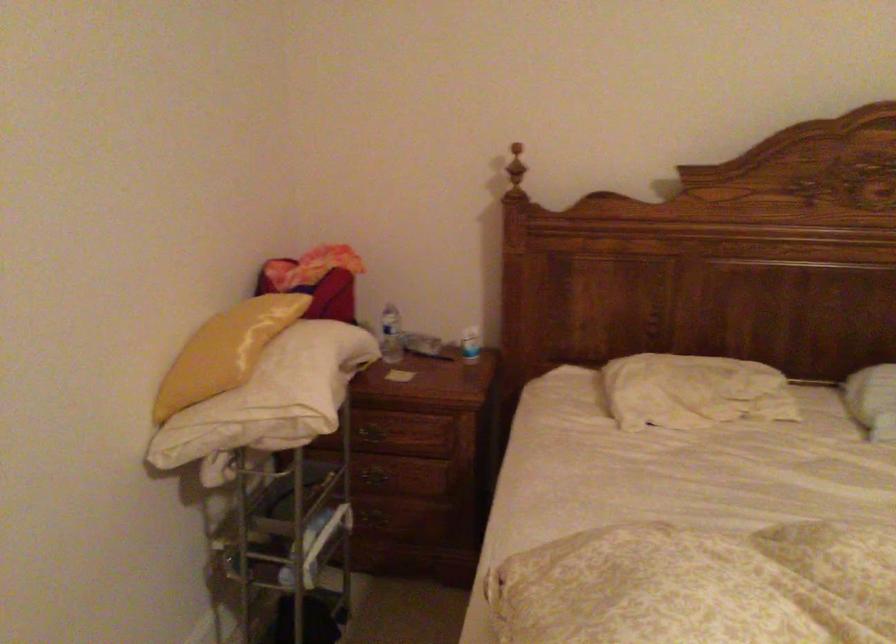
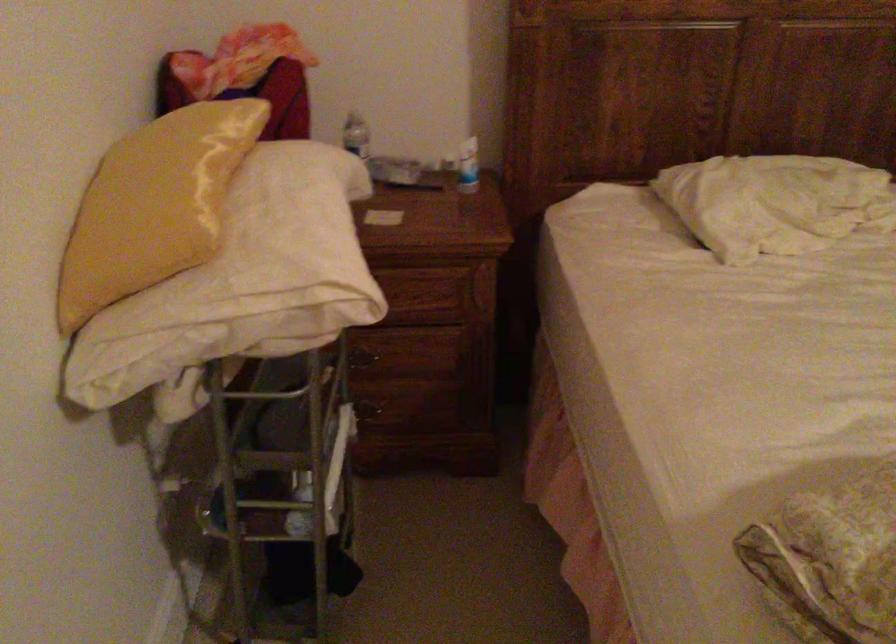
Find the pixel in the second image that matches [470,345] in the first image.

(468, 166)